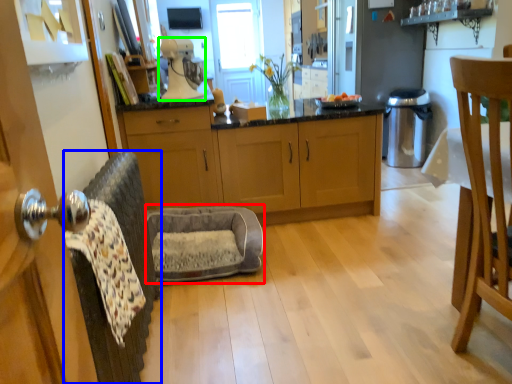
Question: Which object is positioned farthest from swivel chair (highlighted by a red box)? Select from swivel chair (highlighted by a blue box) and coffee machine (highlighted by a green box).

Choices:
 (A) swivel chair
 (B) coffee machine

Answer: (B)